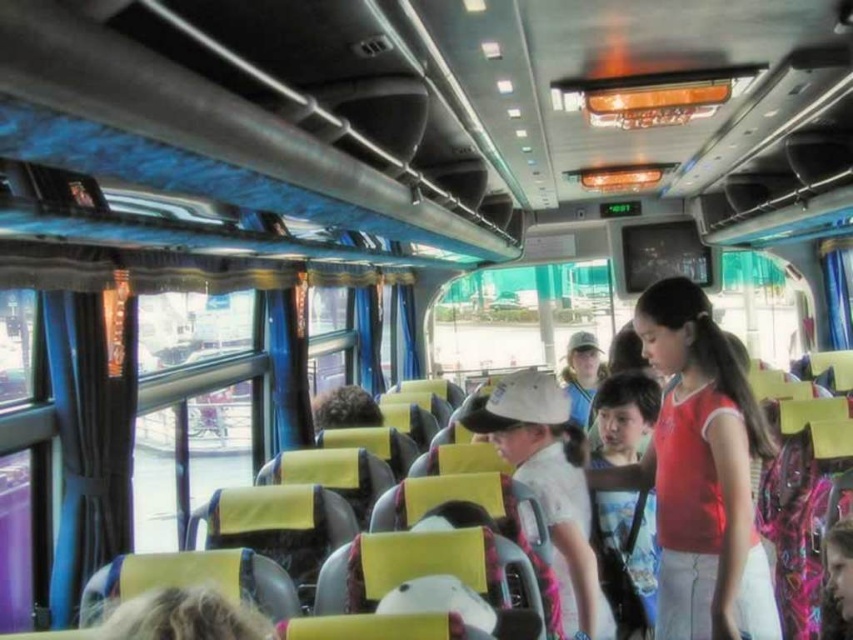
Which is behind, point (520, 392) or point (579, 390)?

The point (579, 390) is behind.

Is white matte hat at center wider than matte white cap at center?

In fact, white matte hat at center might be narrower than matte white cap at center.

Does point (577, 612) come behind point (577, 396)?

No, (577, 612) is closer to viewer.

This screenshot has width=853, height=640. In order to click on white matte hat at center in this screenshot , I will do `click(549, 484)`.